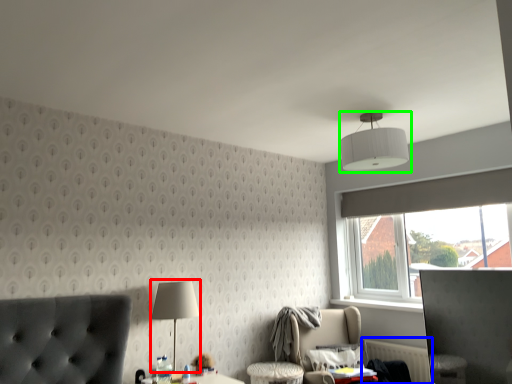
Question: Estimate the real-world distances between objects in this image. Which object is farther from table lamp (highlighted by a red box), radiator (highlighted by a blue box) or lamp (highlighted by a green box)?

Choices:
 (A) radiator
 (B) lamp

Answer: (A)